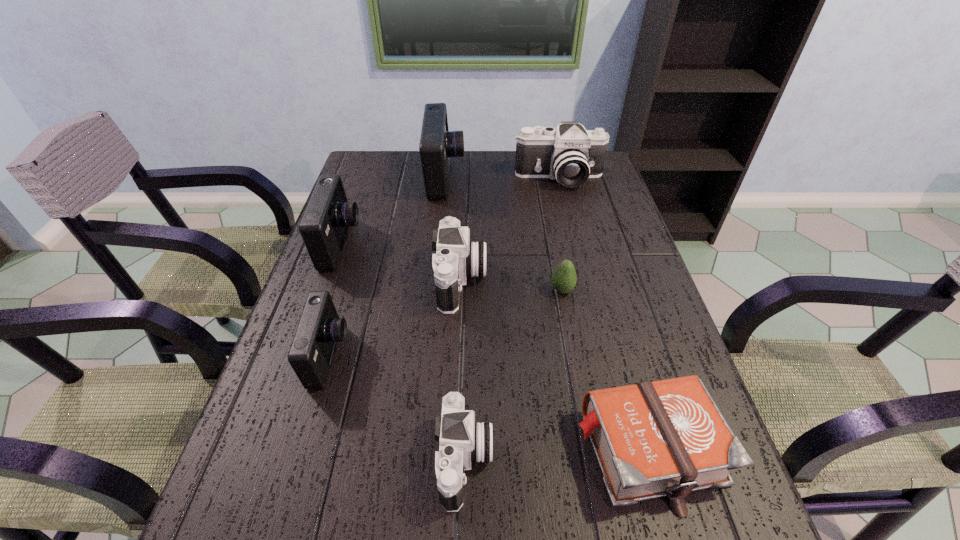
Find the location of a particular element. The image size is (960, 540). empty space that is in between the second biggest blue camera and the second smallest black camera is located at coordinates (401, 262).

Locate an element on the screen. vacant area between the second nearest blue camera and the farthest black camera is located at coordinates (450, 211).

Locate an element on the screen. vacant area that lies between the second nearest camera and the second biggest black camera is located at coordinates (396, 318).

The height and width of the screenshot is (540, 960). Identify the location of object that is the seventh closest to the avocado. [325, 223].

Identify which object is the sixth nearest to the rightmost camera. Please provide its 2D coordinates. Your answer should be formatted as a tuple, i.e. [(x, y)], where the tuple contains the x and y coordinates of a point satisfying the conditions above.

[(667, 438)]

Choose which camera is the nearest neighbor to the smallest blue camera. Please provide its 2D coordinates. Your answer should be formatted as a tuple, i.e. [(x, y)], where the tuple contains the x and y coordinates of a point satisfying the conditions above.

[(325, 223)]

Point out which camera is positioned as the second nearest to the second nearest blue camera. Please provide its 2D coordinates. Your answer should be formatted as a tuple, i.e. [(x, y)], where the tuple contains the x and y coordinates of a point satisfying the conditions above.

[(437, 144)]

Locate an element on the screen. blue camera that is the closest one to the green avocado is located at coordinates (437, 144).

Where is `the second closest blue camera to the rightmost blue camera`? The width and height of the screenshot is (960, 540). the second closest blue camera to the rightmost blue camera is located at coordinates (310, 356).

The height and width of the screenshot is (540, 960). In order to click on the third closest black camera to the green avocado in this screenshot , I will do `click(570, 154)`.